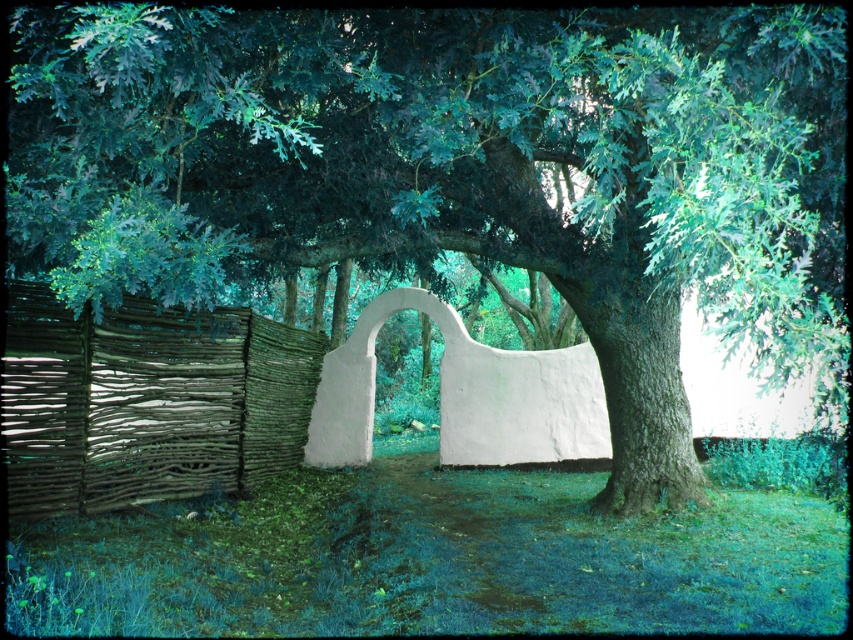
You are planning to place a new decorative item in the garden. You have two options to choose from. The first option is a small garden statue that is exactly the same size as the white matte archway at center. The second option is a large decorative planter that is exactly the same size as the brown woven fence at left. Which decorative item would you choose if you want the one that is larger?

The brown woven fence at left is bigger than the white matte archway at center, so you should choose the large decorative planter that is the same size as the brown woven fence at left if you want the larger option.

You are planning to install a new fence that needs to be as tall as the white matte archway at center. Given the brown woven fence at left is currently in place, can you determine if the existing fence meets the height requirement?

The brown woven fence at left is shorter than the white matte archway at center, so it does not meet the height requirement for the new fence installation.

You are standing in the outdoor scene and want to walk from the brown woven fence at left to the white matte archway at center. Which direction should you move to reach the archway?

The brown woven fence at left is positioned on the left side of the white matte archway at center, so you should move to the right to reach the archway.